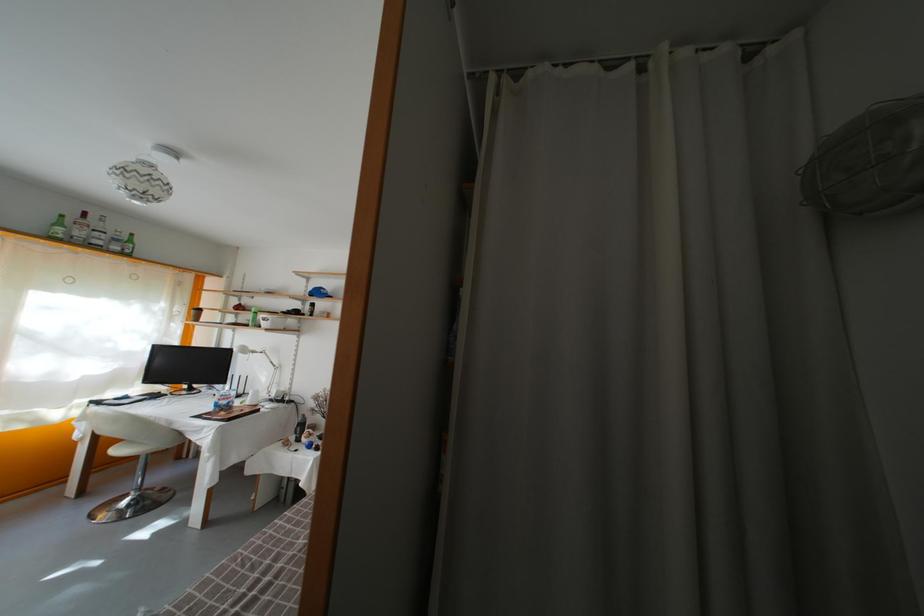
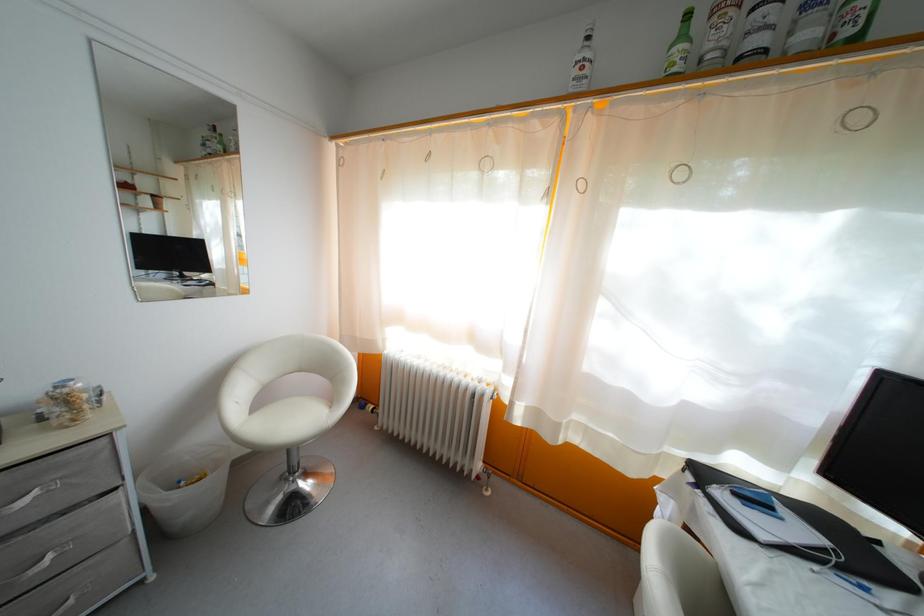
Where in the second image is the point corresponding to the point at 122,254 from the first image?

(812, 42)